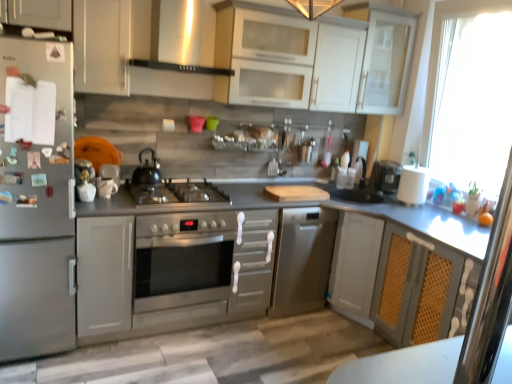
Locate an element on the screen. The image size is (512, 384). free space in front of white matte paper towel at right is located at coordinates (421, 212).